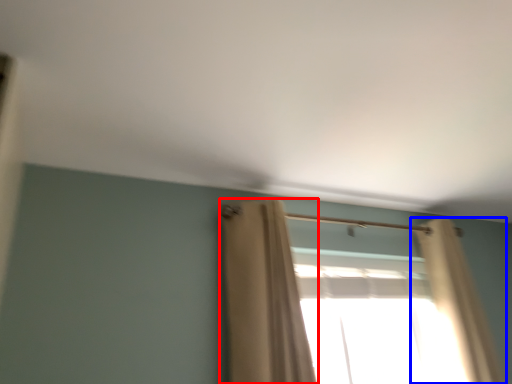
Question: Which of the following is the closest to the observer, curtain (highlighted by a red box) or curtain (highlighted by a blue box)?

Choices:
 (A) curtain
 (B) curtain

Answer: (A)